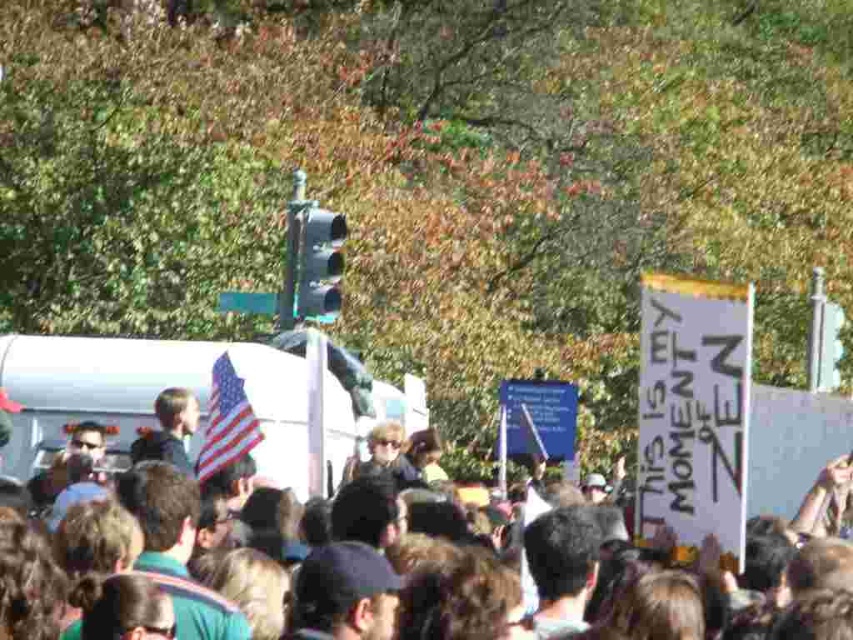
Question: Among these points, which one is farthest from the camera?

Choices:
 (A) (210, 448)
 (B) (773, 392)

Answer: (B)

Question: From the image, what is the correct spatial relationship of white paper sign at center in relation to american flag at center?

Choices:
 (A) left
 (B) right

Answer: (B)

Question: Is white paper sign at center closer to the viewer compared to american flag at center?

Choices:
 (A) yes
 (B) no

Answer: (B)

Question: Which object is closer to the camera taking this photo?

Choices:
 (A) american flag at center
 (B) white paper sign at center

Answer: (A)

Question: Can you confirm if white paper sign at center is smaller than american flag at center?

Choices:
 (A) no
 (B) yes

Answer: (A)

Question: Among these objects, which one is farthest from the camera?

Choices:
 (A) american flag at center
 (B) white paper sign at center

Answer: (B)